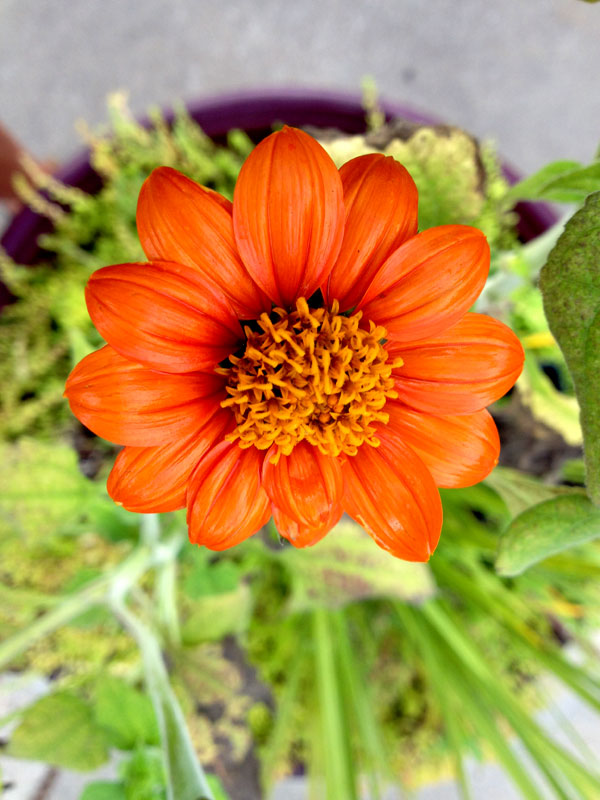
The width and height of the screenshot is (600, 800). In order to click on pot in this screenshot , I will do pyautogui.click(x=257, y=98).